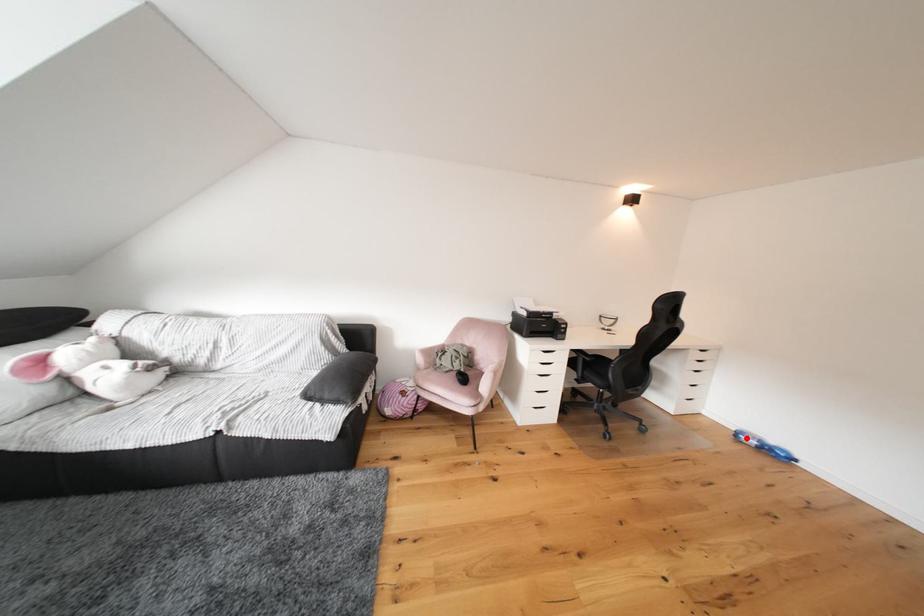
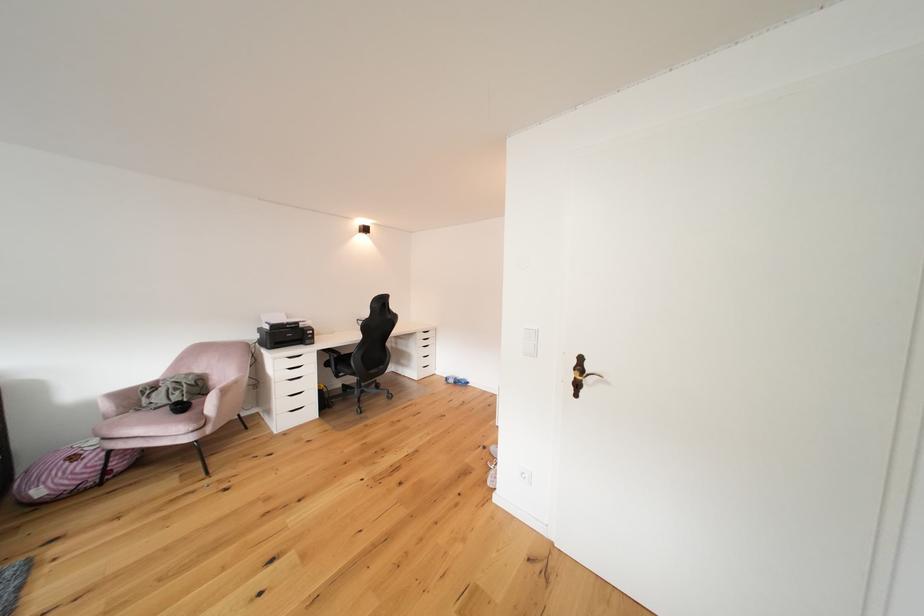
In the second image, find the point that corresponds to the highlighted location in the first image.

(456, 383)